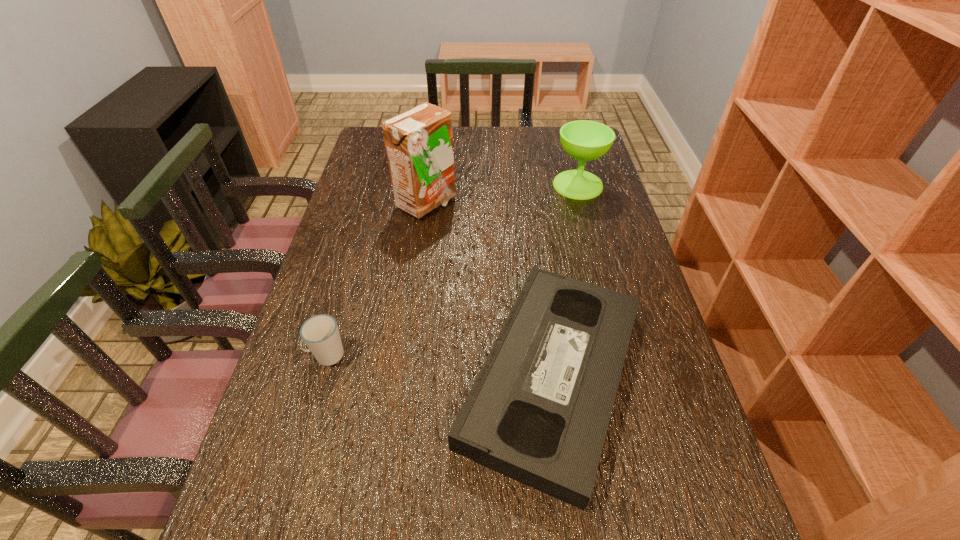
Locate an element on the screen. The image size is (960, 540). wineglass positioned at the right edge is located at coordinates (583, 140).

Identify the location of videotape present at the right edge. (538, 412).

In the image, there is a desktop. At what (x,y) coordinates should I click in order to perform the action: click on free space at the left edge. Please return your answer as a coordinate pair (x, y). The width and height of the screenshot is (960, 540). Looking at the image, I should click on (356, 266).

Find the location of `free location at the right edge of the desktop`. free location at the right edge of the desktop is located at coordinates (669, 465).

At what (x,y) coordinates should I click in order to perform the action: click on free region at the far left corner of the desktop. Please return your answer as a coordinate pair (x, y). The width and height of the screenshot is (960, 540). Looking at the image, I should click on (373, 138).

I want to click on vacant area between the cup and the carton, so click(x=376, y=279).

Identify the location of unoccupied area between the carton and the shortest object. This screenshot has width=960, height=540. (490, 289).

This screenshot has width=960, height=540. Identify the location of vacant space that is in between the tallest object and the cup. [376, 279].

Where is `vacant space that's between the videotape and the second shortest object`? This screenshot has width=960, height=540. vacant space that's between the videotape and the second shortest object is located at coordinates (440, 365).

Find the location of `vacant area between the tallest object and the videotape`. vacant area between the tallest object and the videotape is located at coordinates pos(490,289).